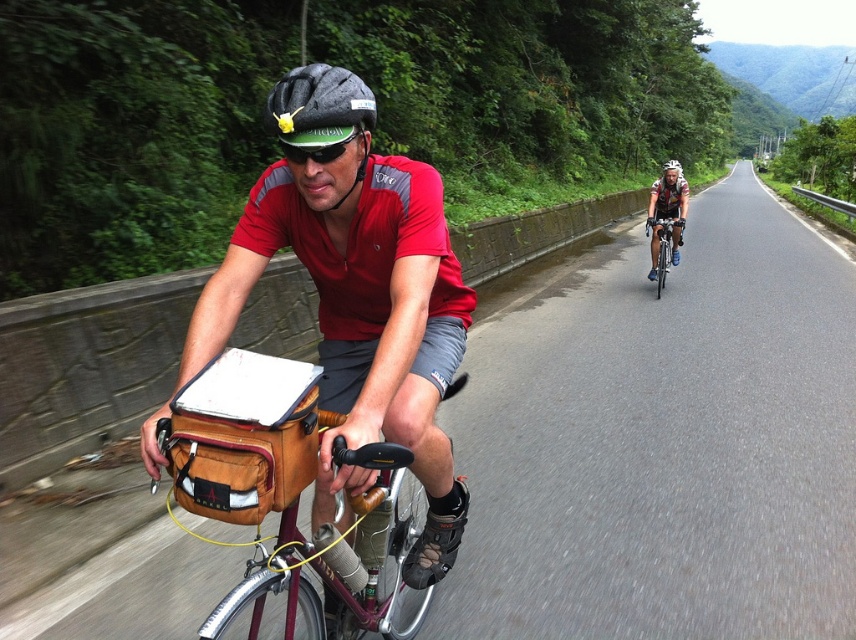
You are a photographer trying to capture both cyclists in a single shot. Given that the matte black helmet at center and the matte black helmet at upper center are both visible, which helmet should you focus on to ensure the cyclist in the foreground is clearly visible?

The matte black helmet at center belongs to the foreground cyclist. Since it occupies less space than the matte black helmet at upper center, focusing on the helmet at center ensures the foreground cyclist is clearly visible.